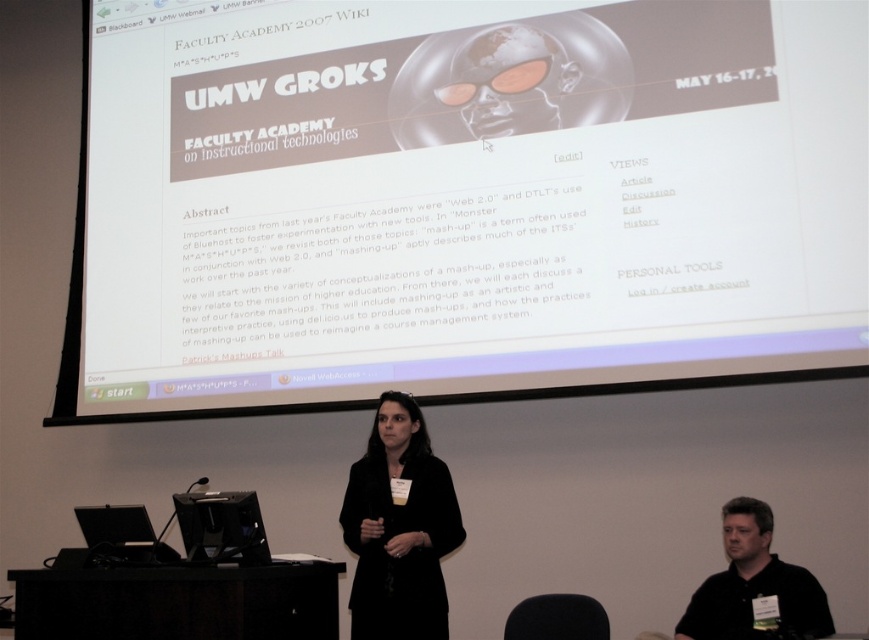
Is point (619, 298) more distant than point (728, 573)?

That is True.

Is white matte projection screen at upper center to the right of black shirt at lower right from the viewer's perspective?

In fact, white matte projection screen at upper center is to the left of black shirt at lower right.

Does point (527, 381) lie in front of point (700, 634)?

No, (527, 381) is behind (700, 634).

Find the location of a particular element. Image resolution: width=869 pixels, height=640 pixels. white matte projection screen at upper center is located at coordinates pos(461,200).

Is white matte projection screen at upper center above black matte jacket at center?

Indeed, white matte projection screen at upper center is positioned over black matte jacket at center.

Is white matte projection screen at upper center positioned at the back of black matte jacket at center?

Yes.

Is point (705, 268) closer to viewer compared to point (400, 435)?

No.

Identify the location of white matte projection screen at upper center. (461, 200).

Can you confirm if black matte jacket at center is wider than black shirt at lower right?

Correct, the width of black matte jacket at center exceeds that of black shirt at lower right.

Who is shorter, black matte jacket at center or black shirt at lower right?

black shirt at lower right is shorter.

Who is more distant from viewer, [385,465] or [828,620]?

The point [385,465] is behind.

Find the location of a particular element. black matte jacket at center is located at coordinates (399, 529).